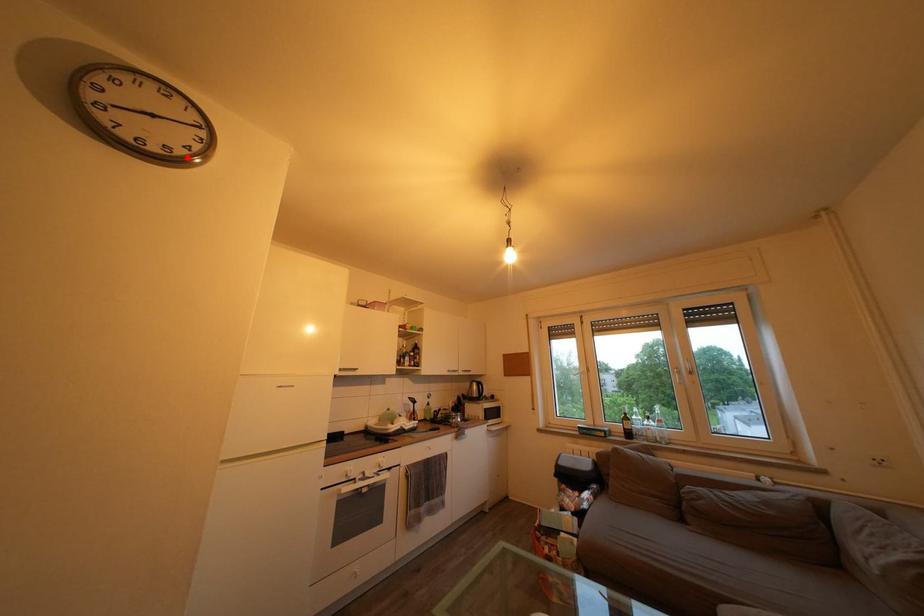
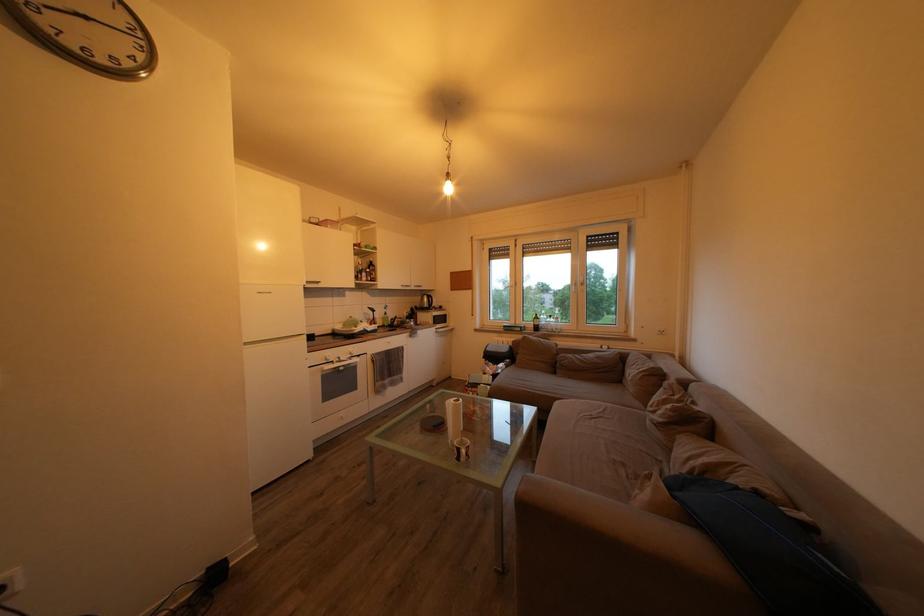
Find the pixel in the second image that matches the highlighted location in the first image.

(134, 69)